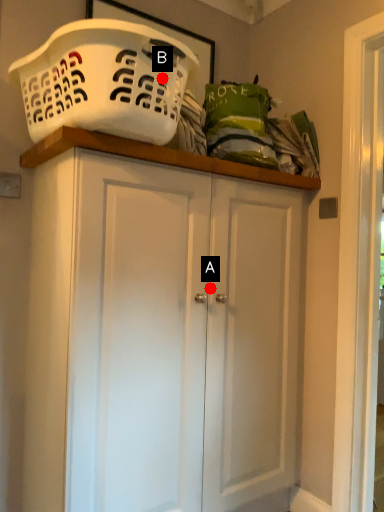
Question: Two points are circled on the image, labeled by A and B beside each circle. Which point is farther from the camera taking this photo?

Choices:
 (A) A is further
 (B) B is further

Answer: (A)